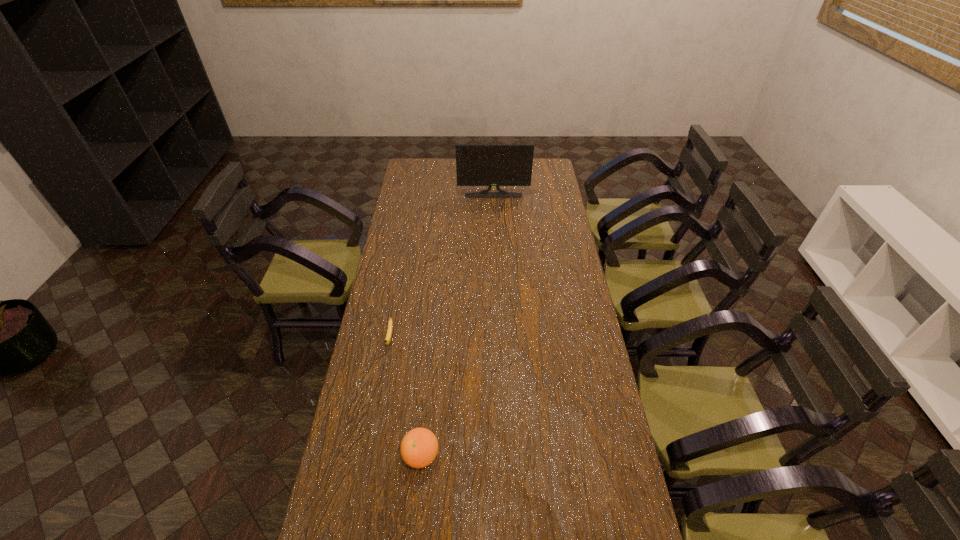
Identify the location of object that is the second nearest to the leftmost object. (489, 165).

Image resolution: width=960 pixels, height=540 pixels. I want to click on object identified as the closest to the orange, so click(387, 340).

Locate an element on the screen. The image size is (960, 540). vacant area in the image that satisfies the following two spatial constraints: 1. at the stem of the shortest object; 2. on the right side of the second tallest object is located at coordinates (369, 456).